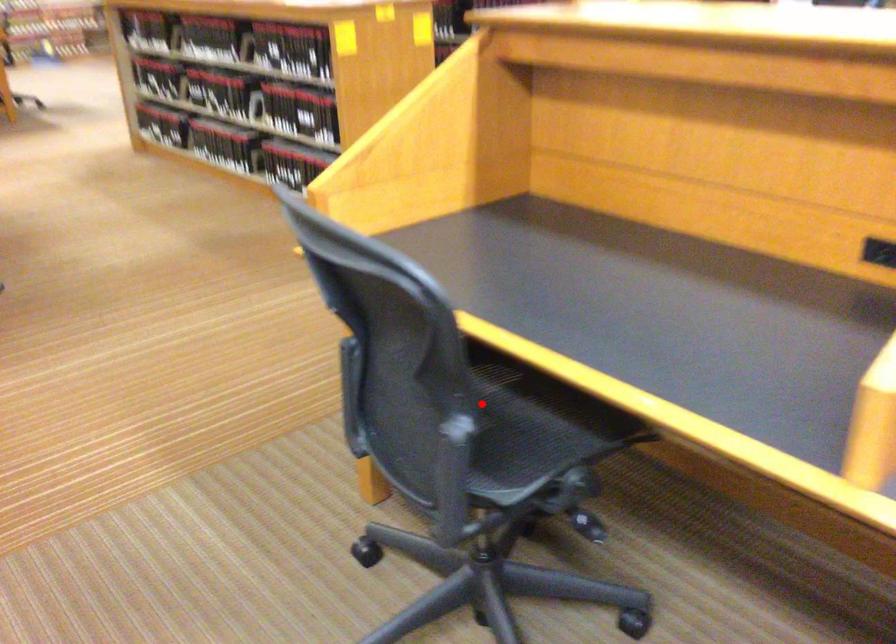
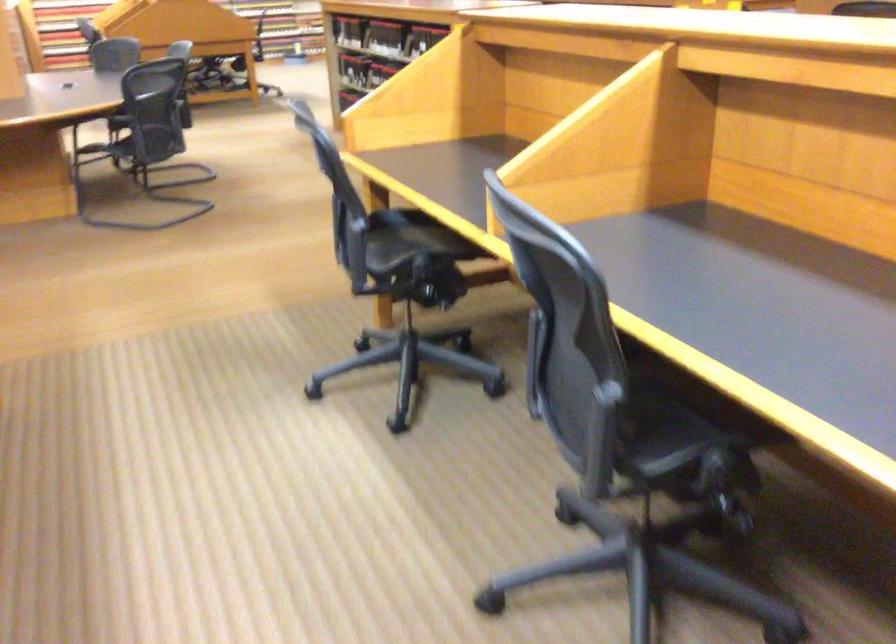
The point at the highlighted location is marked in the first image. Where is the corresponding point in the second image?

(409, 240)